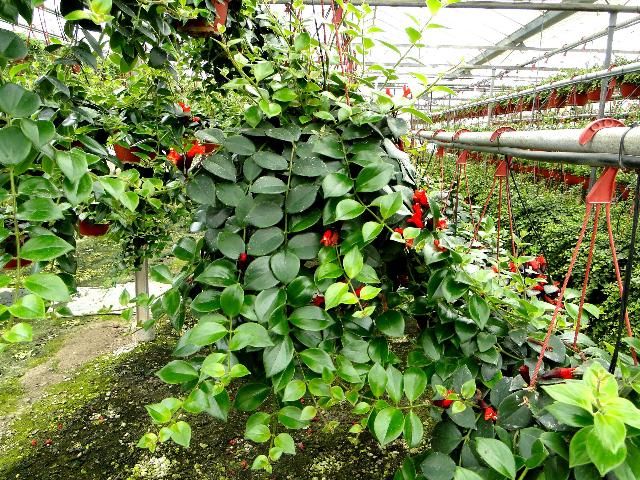
This screenshot has height=480, width=640. In order to click on hanging plant hanger in this screenshot , I will do `click(605, 192)`, `click(499, 169)`.